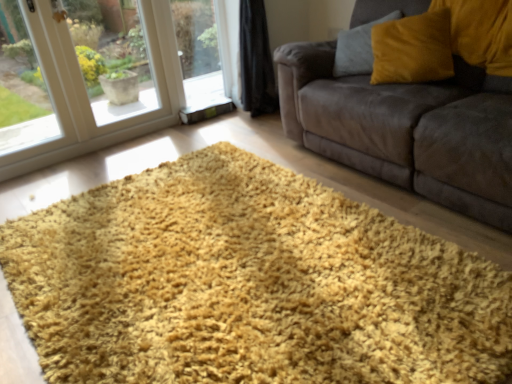
Question: Is velvet brown couch at center positioned beyond the bounds of velvet yellow pillow at upper right?

Choices:
 (A) yes
 (B) no

Answer: (A)

Question: Does velvet brown couch at center have a greater height compared to velvet yellow pillow at upper right?

Choices:
 (A) no
 (B) yes

Answer: (B)

Question: Considering the relative positions of velvet brown couch at center and velvet yellow pillow at upper right in the image provided, is velvet brown couch at center to the left of velvet yellow pillow at upper right from the viewer's perspective?

Choices:
 (A) yes
 (B) no

Answer: (B)

Question: Does velvet brown couch at center have a larger size compared to velvet yellow pillow at upper right?

Choices:
 (A) no
 (B) yes

Answer: (B)

Question: Does velvet brown couch at center lie behind velvet yellow pillow at upper right?

Choices:
 (A) no
 (B) yes

Answer: (A)

Question: Is point (155, 59) closer or farther from the camera than point (219, 337)?

Choices:
 (A) farther
 (B) closer

Answer: (A)

Question: Is transparent glass window at lower left to the left or to the right of yellow shaggy rug at center in the image?

Choices:
 (A) left
 (B) right

Answer: (A)

Question: Is transparent glass window at lower left inside the boundaries of yellow shaggy rug at center, or outside?

Choices:
 (A) inside
 (B) outside

Answer: (B)

Question: In terms of width, does transparent glass window at lower left look wider or thinner when compared to yellow shaggy rug at center?

Choices:
 (A) wide
 (B) thin

Answer: (B)

Question: From the image's perspective, is transparent glass window at lower left positioned above or below velvet brown couch at center?

Choices:
 (A) above
 (B) below

Answer: (A)

Question: Visually, is transparent glass window at lower left positioned to the left or to the right of velvet brown couch at center?

Choices:
 (A) left
 (B) right

Answer: (A)

Question: Is transparent glass window at lower left bigger or smaller than velvet brown couch at center?

Choices:
 (A) big
 (B) small

Answer: (B)

Question: Would you say transparent glass window at lower left is inside or outside velvet brown couch at center?

Choices:
 (A) inside
 (B) outside

Answer: (B)

Question: Is yellow shaggy rug at center bigger or smaller than velvet brown couch at center?

Choices:
 (A) small
 (B) big

Answer: (A)

Question: Based on their positions, is yellow shaggy rug at center located to the left or right of velvet brown couch at center?

Choices:
 (A) right
 (B) left

Answer: (B)